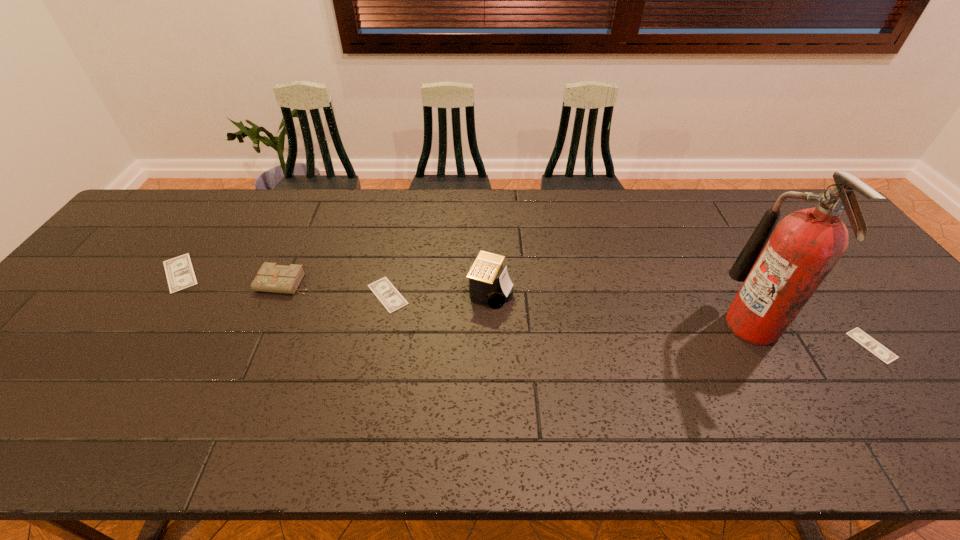
Find the location of a particular element. This screenshot has height=540, width=960. object that is positioned at the right edge is located at coordinates (858, 335).

Where is `free space at the far edge of the desktop`? free space at the far edge of the desktop is located at coordinates (570, 200).

Where is `free location at the near edge of the desktop`? This screenshot has height=540, width=960. free location at the near edge of the desktop is located at coordinates (854, 408).

This screenshot has height=540, width=960. I want to click on free point at the left edge, so click(143, 248).

Locate an element on the screen. The width and height of the screenshot is (960, 540). vacant space at the right edge of the desktop is located at coordinates (848, 260).

What are the coordinates of `vacant space at the far right corner` in the screenshot? It's located at (797, 191).

Where is `free spot between the fifth object from right to left and the tallest money`? Image resolution: width=960 pixels, height=540 pixels. free spot between the fifth object from right to left and the tallest money is located at coordinates (232, 278).

The width and height of the screenshot is (960, 540). Find the location of `blank region between the third tallest object and the leftmost money`. blank region between the third tallest object and the leftmost money is located at coordinates (232, 278).

I want to click on free point between the shortest object and the fifth object from right to left, so click(x=578, y=314).

The image size is (960, 540). Find the location of `vacant area that lies between the tallest object and the leftmost money`. vacant area that lies between the tallest object and the leftmost money is located at coordinates (466, 299).